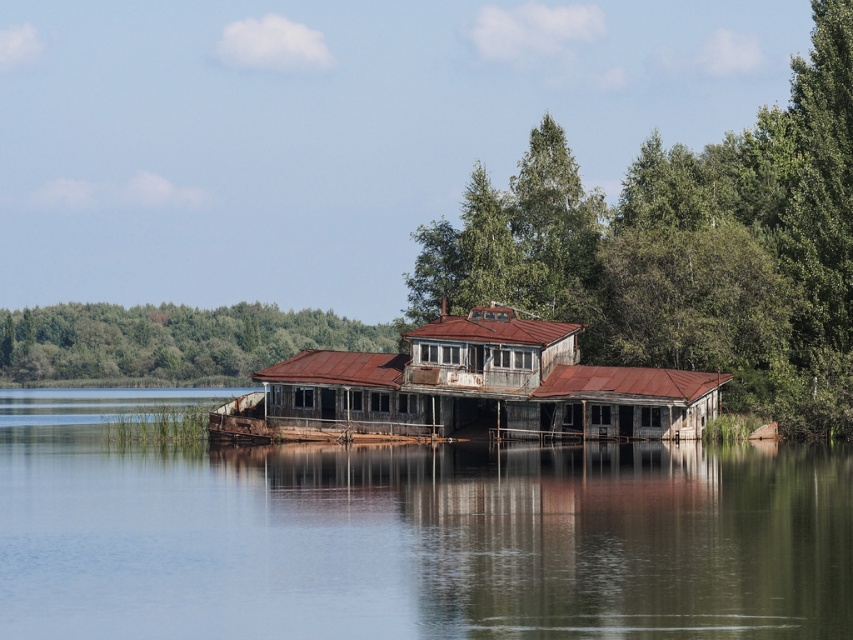
You are a delivery drone with a maximum flight distance of 20 meters. You need to deliver a package from the rusty metallic water at center to the rusty metal hut at center. Can you complete the delivery without recharging?

The distance between the rusty metallic water at center and the rusty metal hut at center is 21.40 meters, which exceeds the drone maximum flight distance of 20 meters. Therefore, the drone cannot complete the delivery without recharging.